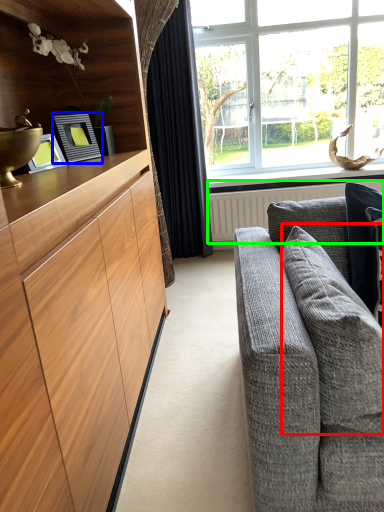
Question: Which is nearer to the pillow (highlighted by a red box)? picture frame (highlighted by a blue box) or radiator (highlighted by a green box).

Choices:
 (A) picture frame
 (B) radiator

Answer: (A)